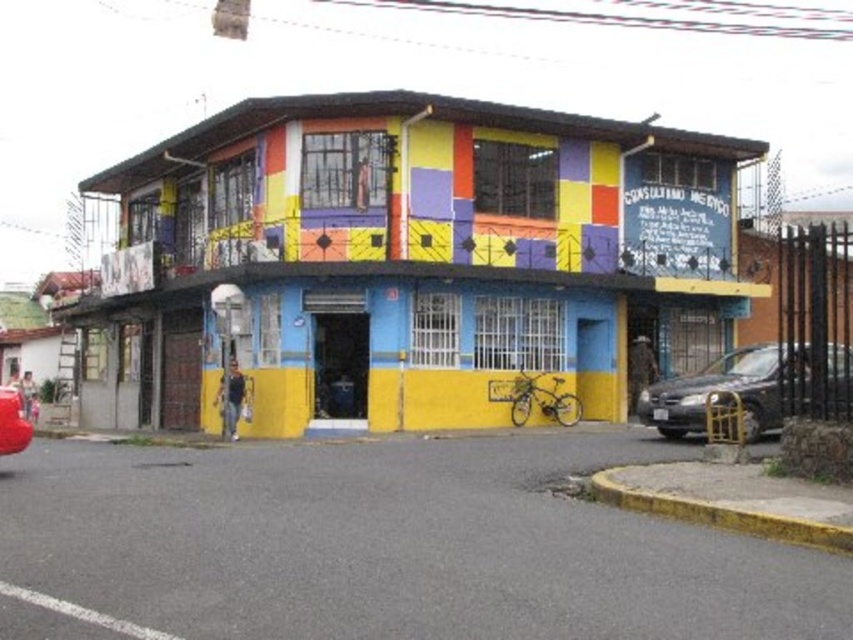
Which of these two, dark gray metallic car at lower right or rubberized red car at lower left, stands taller?

rubberized red car at lower left

Does dark gray metallic car at lower right lie behind rubberized red car at lower left?

Yes, it is.

Where is `dark gray metallic car at lower right`? This screenshot has width=853, height=640. dark gray metallic car at lower right is located at coordinates (730, 390).